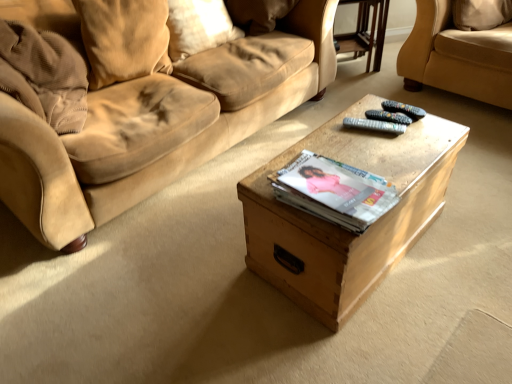
Question: Is black plastic remote at center, positioned as the first remote in top-to-bottom order, not close to suede pillow at upper center, the 1th pillow in the right-to-left sequence?

Choices:
 (A) no
 (B) yes

Answer: (B)

Question: Is black plastic remote at center, positioned as the first remote in top-to-bottom order, in front of suede pillow at upper center, which is counted as the 3th pillow, starting from the left?

Choices:
 (A) yes
 (B) no

Answer: (A)

Question: Does black plastic remote at center, which appears as the second remote when ordered from the bottom, have a lesser width compared to suede pillow at upper center, which is counted as the 3th pillow, starting from the left?

Choices:
 (A) yes
 (B) no

Answer: (A)

Question: From a real-world perspective, is black plastic remote at center, positioned as the first remote in top-to-bottom order, beneath suede pillow at upper center, the 1th pillow in the right-to-left sequence?

Choices:
 (A) no
 (B) yes

Answer: (B)

Question: Is black plastic remote at center, which appears as the second remote when ordered from the bottom, smaller than suede pillow at upper center, which is counted as the 3th pillow, starting from the left?

Choices:
 (A) no
 (B) yes

Answer: (B)

Question: Considering the positions of wooden box at center and suede pillow at upper left, positioned as the second pillow in left-to-right order, in the image, is wooden box at center bigger or smaller than suede pillow at upper left, positioned as the second pillow in left-to-right order,?

Choices:
 (A) big
 (B) small

Answer: (A)

Question: Is point (306, 251) closer or farther from the camera than point (189, 33)?

Choices:
 (A) closer
 (B) farther

Answer: (A)

Question: From the image's perspective, is wooden box at center positioned above or below suede pillow at upper left, arranged as the 2th pillow when viewed from the right?

Choices:
 (A) below
 (B) above

Answer: (A)

Question: Is wooden box at center spatially inside suede pillow at upper left, positioned as the second pillow in left-to-right order, or outside of it?

Choices:
 (A) inside
 (B) outside

Answer: (B)

Question: From a real-world perspective, relative to suede pillow at upper left, which appears as the 1th pillow when viewed from the left, is suede pillow at upper center, which is counted as the 3th pillow, starting from the left, vertically above or below?

Choices:
 (A) above
 (B) below

Answer: (B)

Question: Based on their positions, is suede pillow at upper center, which is counted as the 3th pillow, starting from the left, located to the left or right of suede pillow at upper left, which is the third pillow in right-to-left order?

Choices:
 (A) left
 (B) right

Answer: (B)

Question: Is suede pillow at upper center, the 1th pillow in the right-to-left sequence, bigger or smaller than suede pillow at upper left, which is the third pillow in right-to-left order?

Choices:
 (A) big
 (B) small

Answer: (A)

Question: Considering the positions of suede pillow at upper center, which is counted as the 3th pillow, starting from the left, and suede pillow at upper left, which appears as the 1th pillow when viewed from the left, in the image, is suede pillow at upper center, which is counted as the 3th pillow, starting from the left, taller or shorter than suede pillow at upper left, which appears as the 1th pillow when viewed from the left,?

Choices:
 (A) short
 (B) tall

Answer: (A)

Question: Considering their positions, is suede beige couch at upper right located in front of or behind black plastic remote at center, which appears as the second remote when ordered from the bottom?

Choices:
 (A) front
 (B) behind

Answer: (B)

Question: Looking at the image, does suede beige couch at upper right seem bigger or smaller compared to black plastic remote at center, positioned as the first remote in top-to-bottom order?

Choices:
 (A) small
 (B) big

Answer: (B)